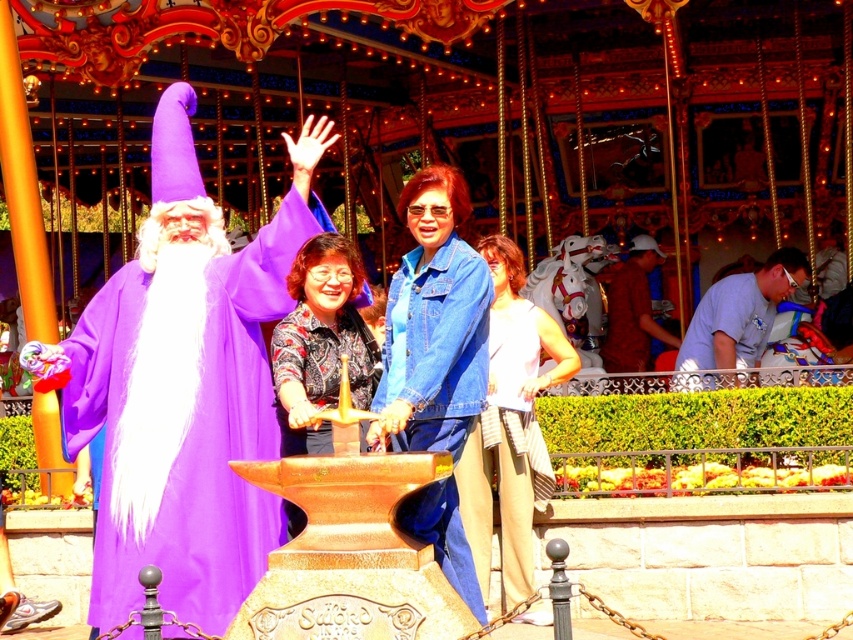
Question: Which object is positioned farthest from the denim jacket at center?

Choices:
 (A) white cotton tank top at center
 (B) brown fabric shirt at center

Answer: (B)

Question: Does white cotton tank top at center lie in front of light blue denim shirt at right?

Choices:
 (A) no
 (B) yes

Answer: (B)

Question: Where is white cotton tank top at center located in relation to brown fabric shirt at center in the image?

Choices:
 (A) right
 (B) left

Answer: (B)

Question: Can you confirm if light blue denim shirt at right is positioned to the left of brown fabric shirt at center?

Choices:
 (A) no
 (B) yes

Answer: (A)

Question: Which point is closer to the camera?

Choices:
 (A) light blue denim shirt at right
 (B) brown fabric shirt at center

Answer: (A)

Question: Among these objects, which one is nearest to the camera?

Choices:
 (A) brown fabric shirt at center
 (B) denim jacket at center
 (C) light blue denim shirt at right

Answer: (B)